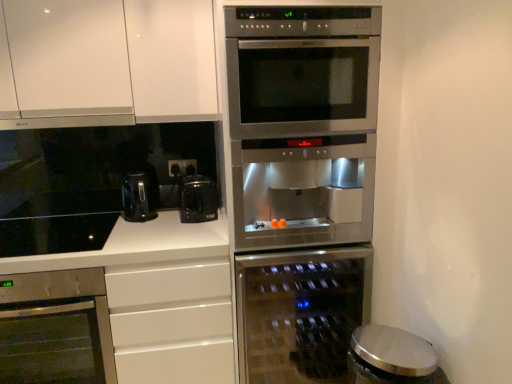
Question: From the image's perspective, would you say white glossy countertop at lower left is positioned over metallic silver trash can at lower right, marked as the 2th appliance in a back-to-front arrangement?

Choices:
 (A) no
 (B) yes

Answer: (B)

Question: Is white glossy countertop at lower left positioned far away from metallic silver trash can at lower right, marked as the 2th appliance in a back-to-front arrangement?

Choices:
 (A) yes
 (B) no

Answer: (A)

Question: From a real-world perspective, is white glossy countertop at lower left under metallic silver trash can at lower right, marked as the 2th appliance in a back-to-front arrangement?

Choices:
 (A) no
 (B) yes

Answer: (B)

Question: Is white glossy countertop at lower left at the left side of metallic silver trash can at lower right, which appears as the first appliance when viewed from the front?

Choices:
 (A) yes
 (B) no

Answer: (A)

Question: Is white glossy countertop at lower left facing away from metallic silver trash can at lower right, marked as the 2th appliance in a back-to-front arrangement?

Choices:
 (A) no
 (B) yes

Answer: (A)

Question: In terms of height, does white matte cabinet at upper left look taller or shorter compared to black plastic electric outlet at center?

Choices:
 (A) short
 (B) tall

Answer: (B)

Question: In terms of width, does white matte cabinet at upper left look wider or thinner when compared to black plastic electric outlet at center?

Choices:
 (A) wide
 (B) thin

Answer: (A)

Question: From the image's perspective, is white matte cabinet at upper left above or below black plastic electric outlet at center?

Choices:
 (A) above
 (B) below

Answer: (A)

Question: Is white matte cabinet at upper left bigger or smaller than black plastic electric outlet at center?

Choices:
 (A) big
 (B) small

Answer: (A)

Question: From a real-world perspective, relative to white matte cabinet at upper left, is white glossy countertop at lower left vertically above or below?

Choices:
 (A) above
 (B) below

Answer: (B)

Question: Looking at the image, does white glossy countertop at lower left seem bigger or smaller compared to white matte cabinet at upper left?

Choices:
 (A) small
 (B) big

Answer: (B)

Question: In the image, is white glossy countertop at lower left positioned in front of or behind white matte cabinet at upper left?

Choices:
 (A) behind
 (B) front

Answer: (B)

Question: Visually, is white glossy countertop at lower left positioned to the left or to the right of white matte cabinet at upper left?

Choices:
 (A) left
 (B) right

Answer: (A)

Question: Is stainless steel oven at center, the second oven viewed from the left, taller or shorter than stainless steel oven at lower left, acting as the first oven starting from the left?

Choices:
 (A) short
 (B) tall

Answer: (B)

Question: Would you say stainless steel oven at center, the second oven viewed from the left, is inside or outside stainless steel oven at lower left, acting as the first oven starting from the left?

Choices:
 (A) inside
 (B) outside

Answer: (B)